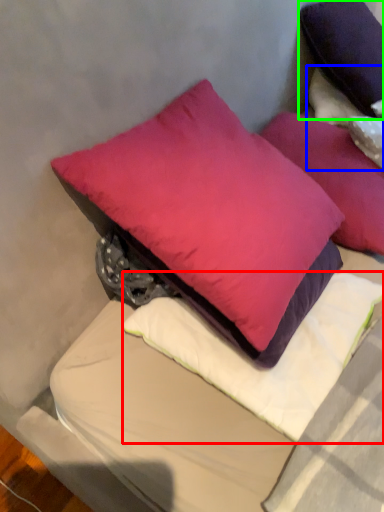
Question: Which object is the closest to the pillow (highlighted by a red box)? Choose among these: pillow (highlighted by a blue box) or pillow (highlighted by a green box).

Choices:
 (A) pillow
 (B) pillow

Answer: (A)